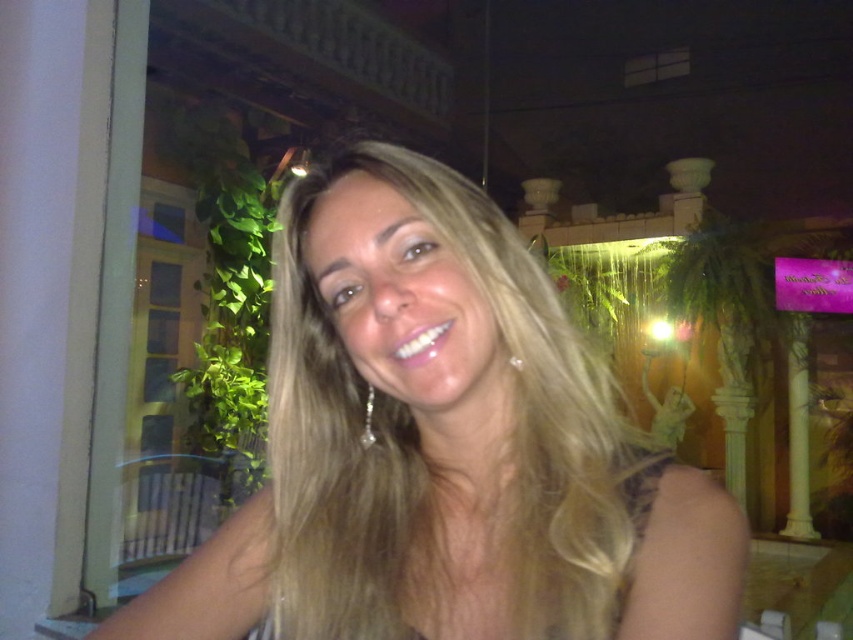
The person with blonde hair at center is talking to someone. How far apart are they?

The person with blonde hair at center is 16.08 inches away from the other person.